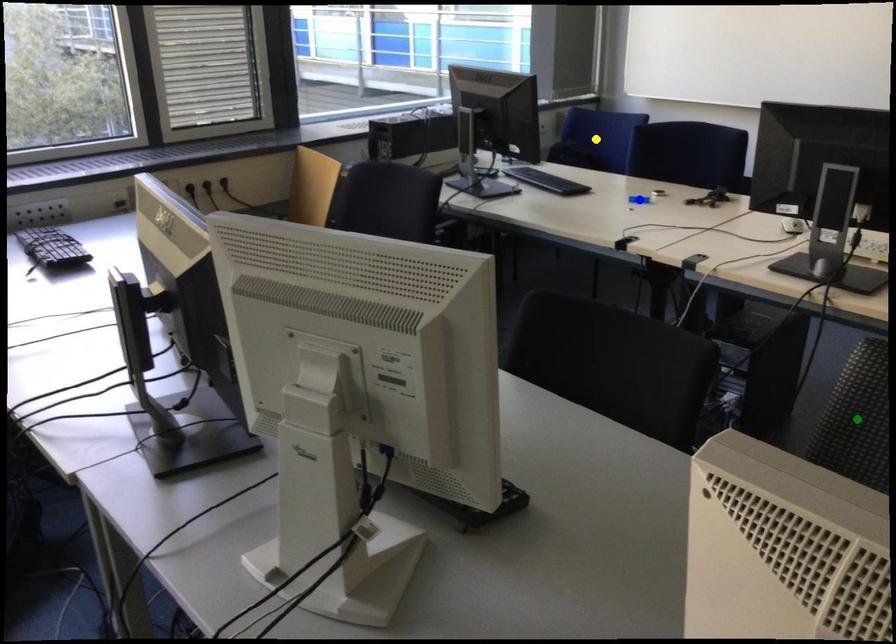
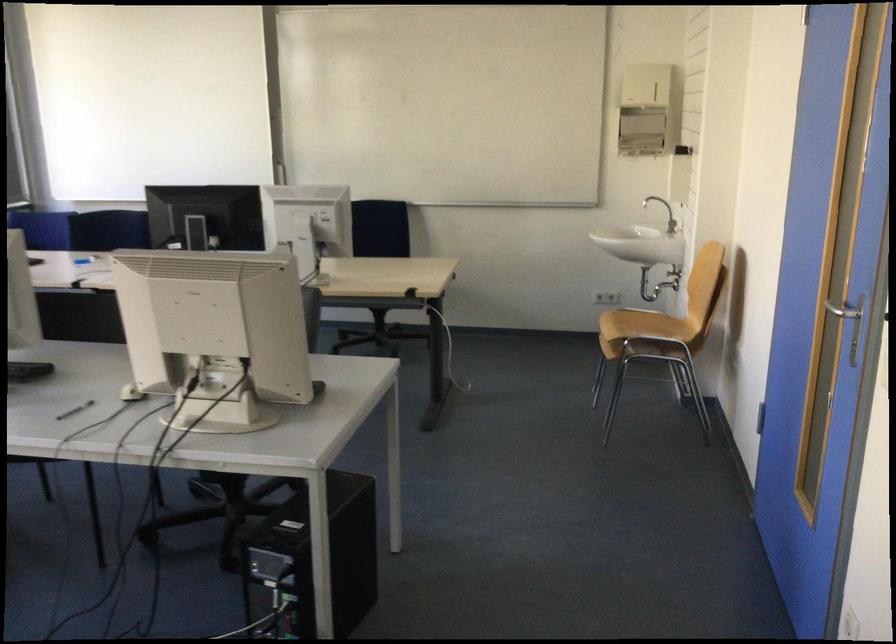
I am providing you with two images of the same scene from different viewpoints. Three points are marked in image1. Which point corresponds to a part or object that is occluded in image2?In image1, three points are marked. Which of them correspond to a part or object that is occluded in image2?Among the three points shown in image1, which one corresponds to a part or object that is no longer visible due to occlusion in image2?

yellow point, blue point, green point cannot be seen in image2.